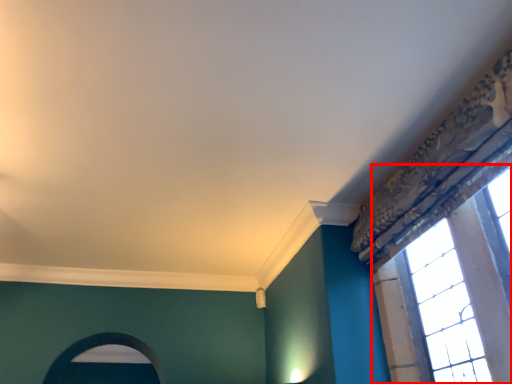
Question: Observing the image, what is the correct spatial positioning of window (annotated by the red box) in reference to archway?

Choices:
 (A) left
 (B) right

Answer: (B)